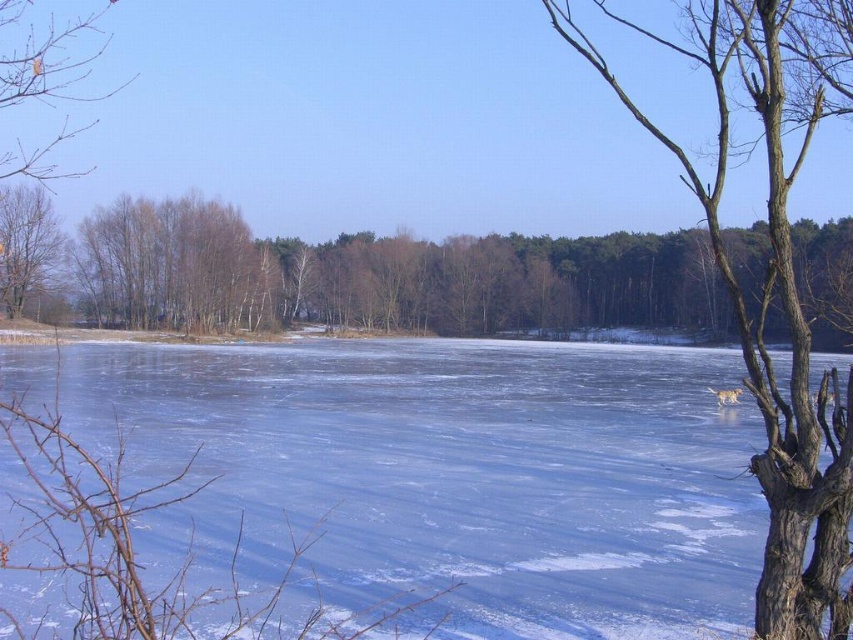
You are an ice skater standing on the frozen lake and want to skate towards the brown bark tree at center and the smooth brown tree trunk at left. Which tree should you head toward if you want to reach the closer one first?

The smooth brown tree trunk at left is closer to you than the brown bark tree at center, so you should head toward the smooth brown tree trunk at left first.

You are an environmental scientist examining the winter landscape. You need to determine which tree has a larger circumference between the smooth bark tree at right and the smooth brown tree trunk at left. Based on the image, which one do you think has a larger circumference?

The smooth bark tree at right is bigger than the smooth brown tree trunk at left, so the smooth bark tree at right has a larger circumference.